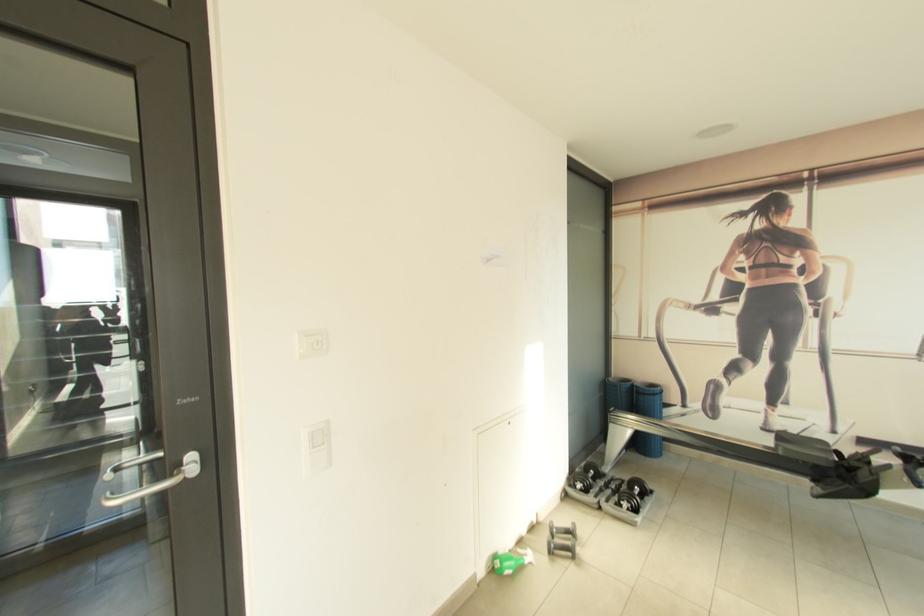
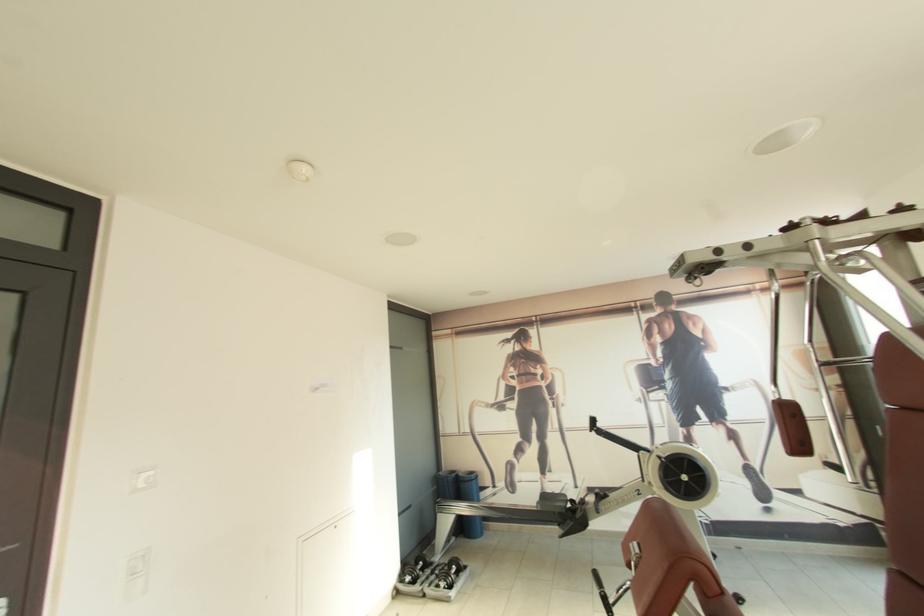
Locate, in the second image, the point that corresponds to the point at 658,387 in the first image.

(476, 475)